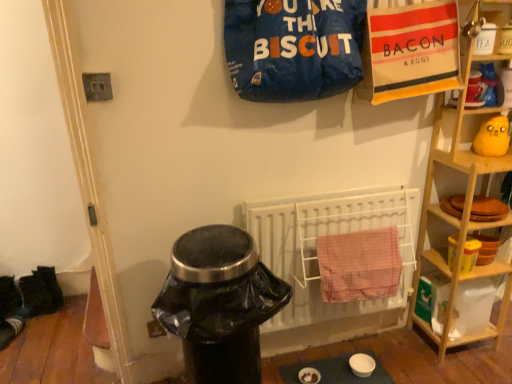
At what (x,y) coordinates should I click in order to perform the action: click on vacant area that is situated to the right of matte blue table at lower center. Please return your answer as a coordinate pair (x, y). Looking at the image, I should click on (404, 355).